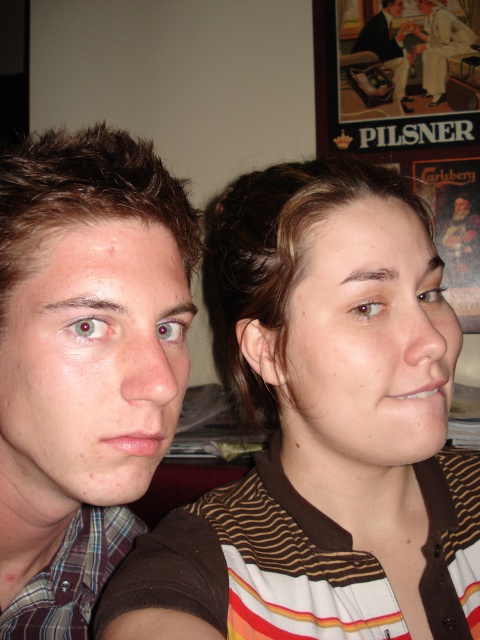
Question: Does brown striped shirt at center have a greater width compared to light beige suit at upper right?

Choices:
 (A) no
 (B) yes

Answer: (B)

Question: Which of the following is the closest to the observer?

Choices:
 (A) smooth skin face at upper center
 (B) brown striped shirt at center

Answer: (B)

Question: Which point is closer to the camera?

Choices:
 (A) matte paper poster at upper right
 (B) smooth skin face at upper center

Answer: (A)

Question: Among these points, which one is farthest from the camera?

Choices:
 (A) (27, 413)
 (B) (305, 246)

Answer: (B)

Question: Does matte skin face at left have a greater width compared to light beige suit at upper right?

Choices:
 (A) no
 (B) yes

Answer: (A)

Question: Does brown striped shirt at center have a smaller size compared to matte skin face at left?

Choices:
 (A) yes
 (B) no

Answer: (B)